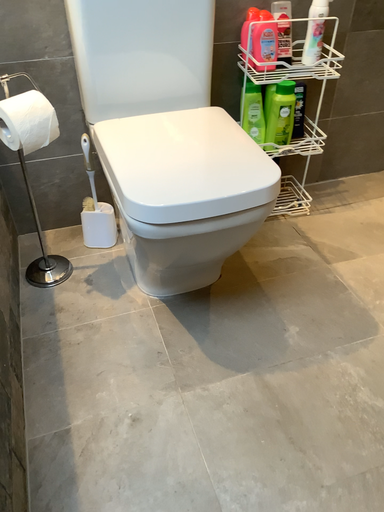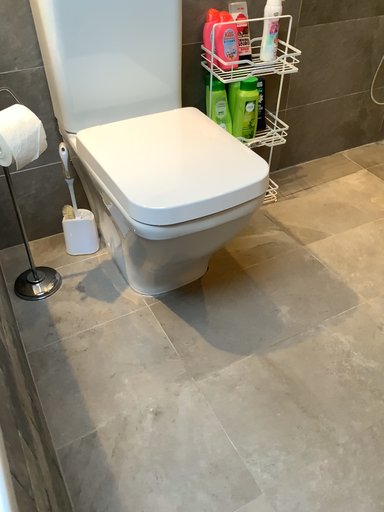
Question: How did the camera likely rotate when shooting the video?

Choices:
 (A) rotated right
 (B) rotated left

Answer: (A)